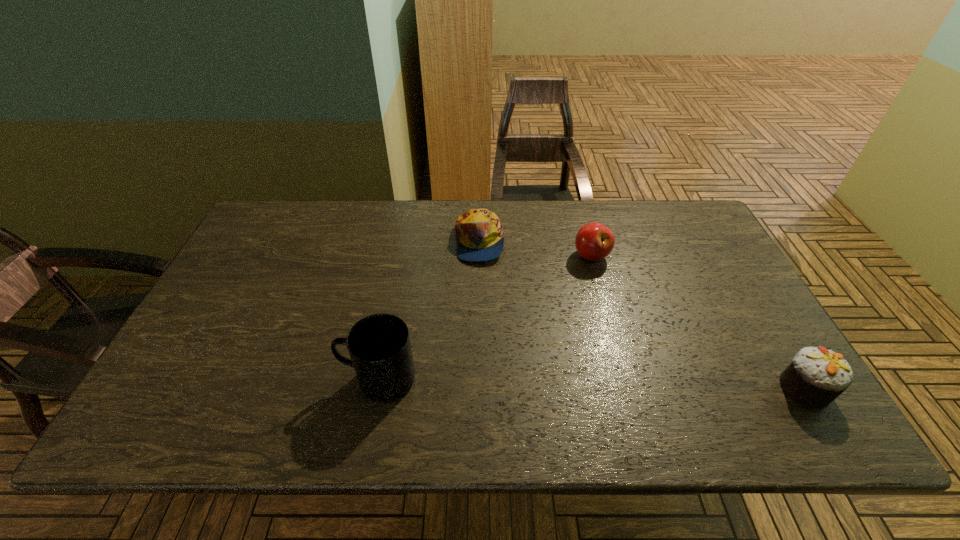
The width and height of the screenshot is (960, 540). Find the location of `empty space between the cupcake and the cap`. empty space between the cupcake and the cap is located at coordinates (642, 315).

Image resolution: width=960 pixels, height=540 pixels. In order to click on free point between the mug and the apple in this screenshot , I will do `click(486, 318)`.

In order to click on unoccupied area between the leftmost object and the cap in this screenshot , I will do `click(429, 310)`.

Find the location of a particular element. This screenshot has width=960, height=540. vacant space that is in between the shortest object and the tallest object is located at coordinates (429, 310).

The width and height of the screenshot is (960, 540). What are the coordinates of `free space between the third object from right to left and the rightmost object` in the screenshot? It's located at (642, 315).

The width and height of the screenshot is (960, 540). I want to click on free spot between the leftmost object and the second object from left to right, so click(429, 310).

Locate an element on the screen. empty space between the cupcake and the apple is located at coordinates (698, 322).

Locate which object ranks second in proximity to the shortest object. Please provide its 2D coordinates. Your answer should be formatted as a tuple, i.e. [(x, y)], where the tuple contains the x and y coordinates of a point satisfying the conditions above.

[(379, 345)]

Where is `the third closest object to the third object from left to right`? the third closest object to the third object from left to right is located at coordinates (379, 345).